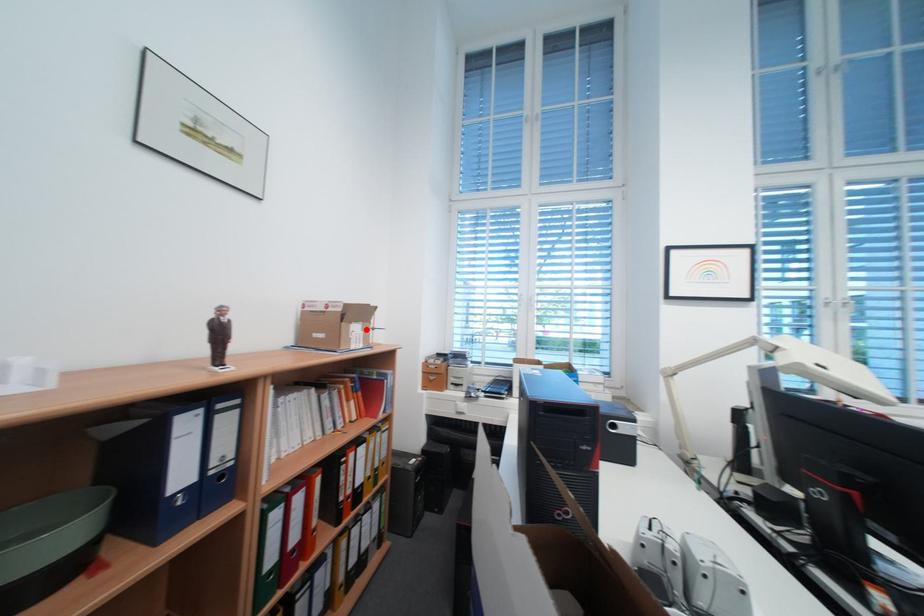
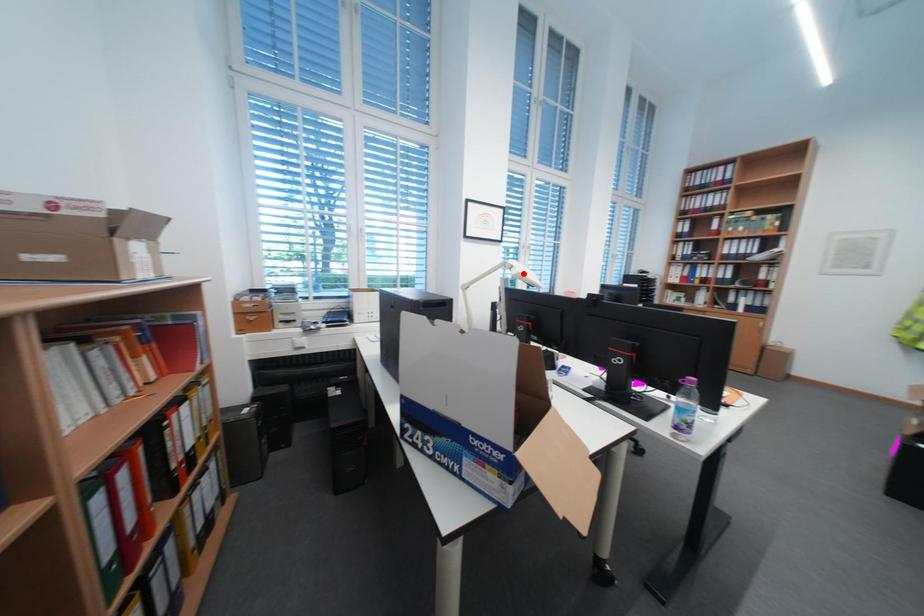
I am providing you with two images of the same scene from different viewpoints. A red point is marked on the first image and another point is marked on the second image. Do the highlighted points in image1 and image2 indicate the same real-world spot?

No